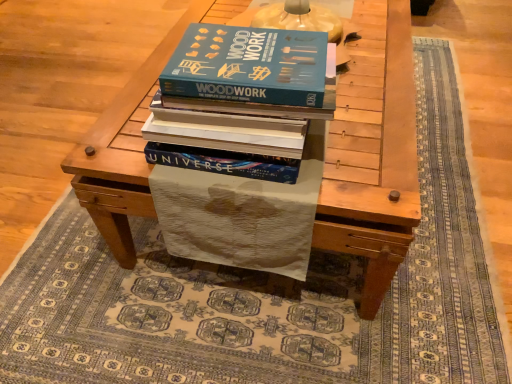
Question: Is wooden table at center taller or shorter than blue hardcover book at center?

Choices:
 (A) short
 (B) tall

Answer: (B)

Question: In the image, is wooden table at center positioned in front of or behind blue hardcover book at center?

Choices:
 (A) front
 (B) behind

Answer: (B)

Question: Is point (346, 180) positioned closer to the camera than point (218, 135)?

Choices:
 (A) farther
 (B) closer

Answer: (A)

Question: From their relative heights in the image, would you say blue hardcover book at center is taller or shorter than wooden table at center?

Choices:
 (A) short
 (B) tall

Answer: (A)

Question: Visually, is blue hardcover book at center positioned to the left or to the right of wooden table at center?

Choices:
 (A) right
 (B) left

Answer: (B)

Question: From a real-world perspective, relative to wooden table at center, is blue hardcover book at center vertically above or below?

Choices:
 (A) below
 (B) above

Answer: (B)

Question: Considering their positions, is blue hardcover book at center located in front of or behind wooden table at center?

Choices:
 (A) behind
 (B) front

Answer: (B)